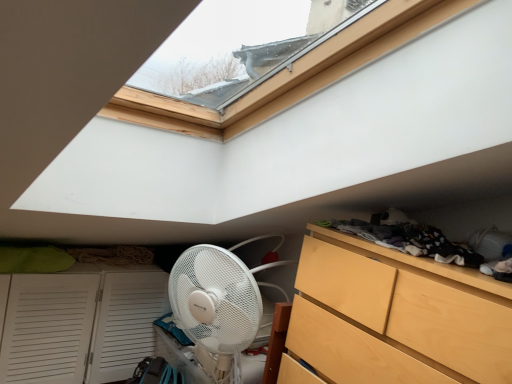
Question: Is dark gray fabric at upper right in front of or behind white louvered cupboard at lower left in the image?

Choices:
 (A) behind
 (B) front

Answer: (B)

Question: Considering the positions of dark gray fabric at upper right and white louvered cupboard at lower left in the image, is dark gray fabric at upper right wider or thinner than white louvered cupboard at lower left?

Choices:
 (A) thin
 (B) wide

Answer: (A)

Question: Which object is the farthest from the white louvered cupboard at lower left?

Choices:
 (A) light wood dresser at lower right
 (B) dark gray fabric at upper right

Answer: (B)

Question: Which object is the farthest from the white louvered cupboard at lower left?

Choices:
 (A) dark gray fabric at upper right
 (B) light wood dresser at lower right

Answer: (A)